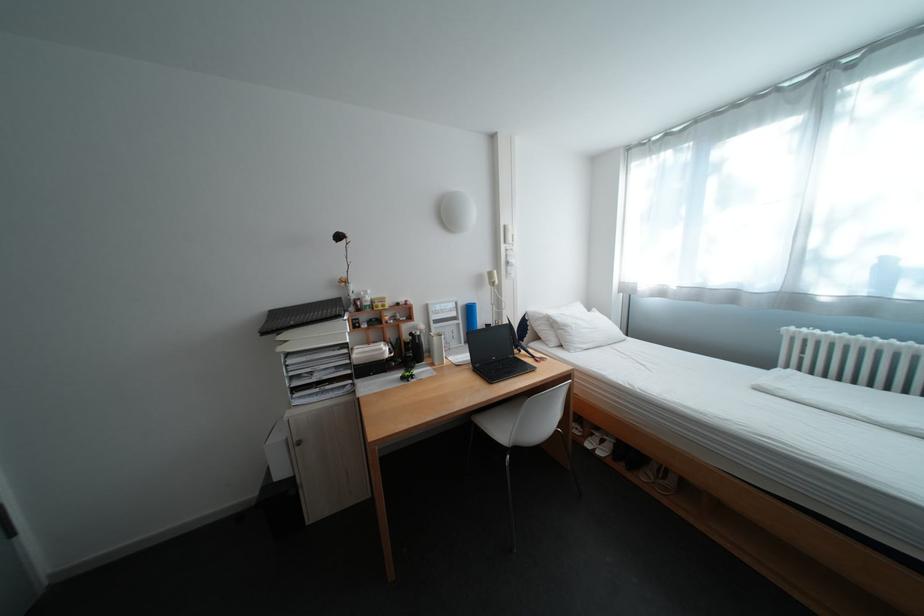
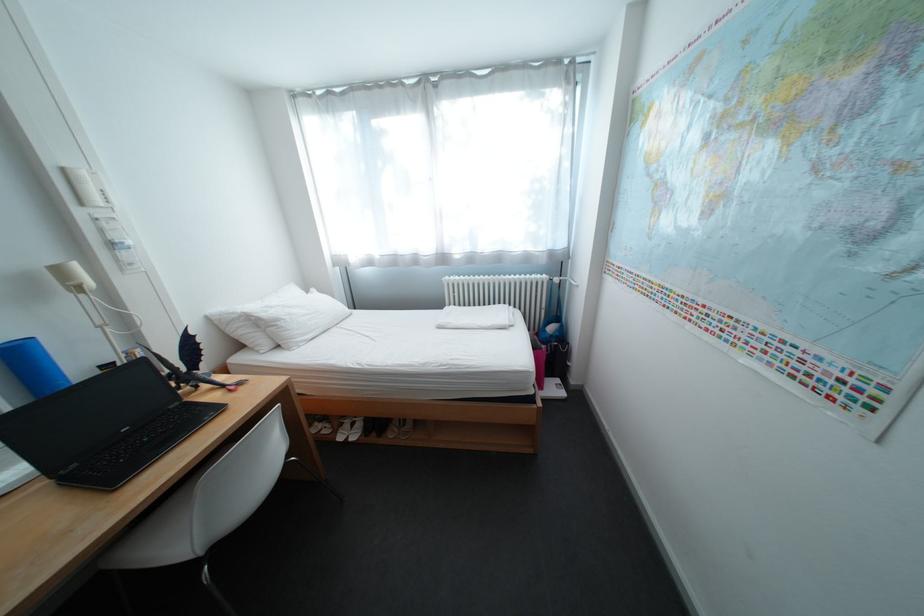
Where in the second image is the point corresponding to (x=504, y=275) from the first image?

(71, 272)